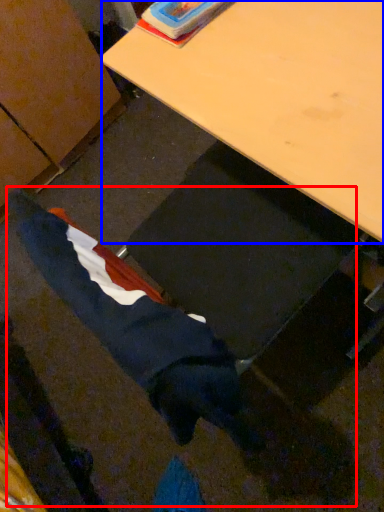
Question: Among these objects, which one is nearest to the camera, woman (highlighted by a red box) or desk (highlighted by a blue box)?

Choices:
 (A) woman
 (B) desk

Answer: (A)